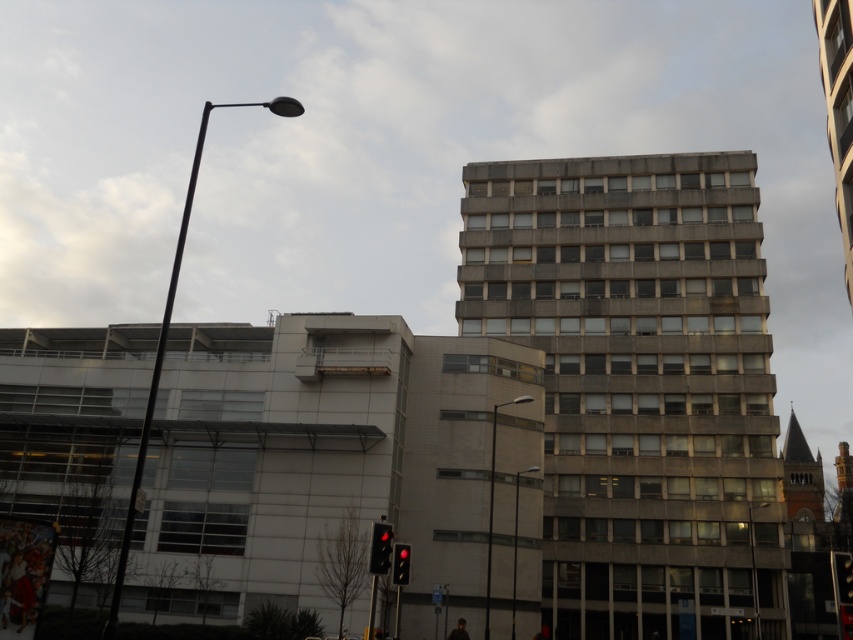
Question: Is red brick tower at right above red glass traffic light at center?

Choices:
 (A) no
 (B) yes

Answer: (A)

Question: Which object is closer to the camera taking this photo?

Choices:
 (A) concrete building at center
 (B) metallic pole at center
 (C) red brick tower at right

Answer: (A)

Question: Can you confirm if concrete building at center is positioned below red glass traffic light at lower center?

Choices:
 (A) yes
 (B) no

Answer: (B)

Question: Estimate the real-world distances between objects in this image. Which object is closer to the concrete building at center?

Choices:
 (A) matte black traffic light at center
 (B) black metal street light at upper left
 (C) metallic silver street light at center

Answer: (C)

Question: Which of these objects is positioned closest to the metallic pole at center?

Choices:
 (A) concrete building at center
 (B) black glass street light at center
 (C) red brick tower at right
 (D) metallic silver street light at center

Answer: (A)

Question: Is concrete building at center to the left of black glass street light at center from the viewer's perspective?

Choices:
 (A) yes
 (B) no

Answer: (B)